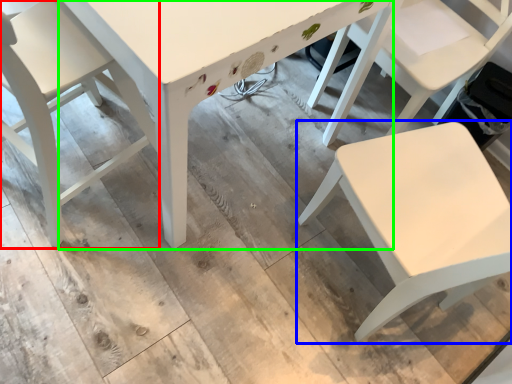
Question: Which object is positioned farthest from chair (highlighted by a red box)? Select from chair (highlighted by a blue box) and table (highlighted by a green box).

Choices:
 (A) chair
 (B) table

Answer: (A)